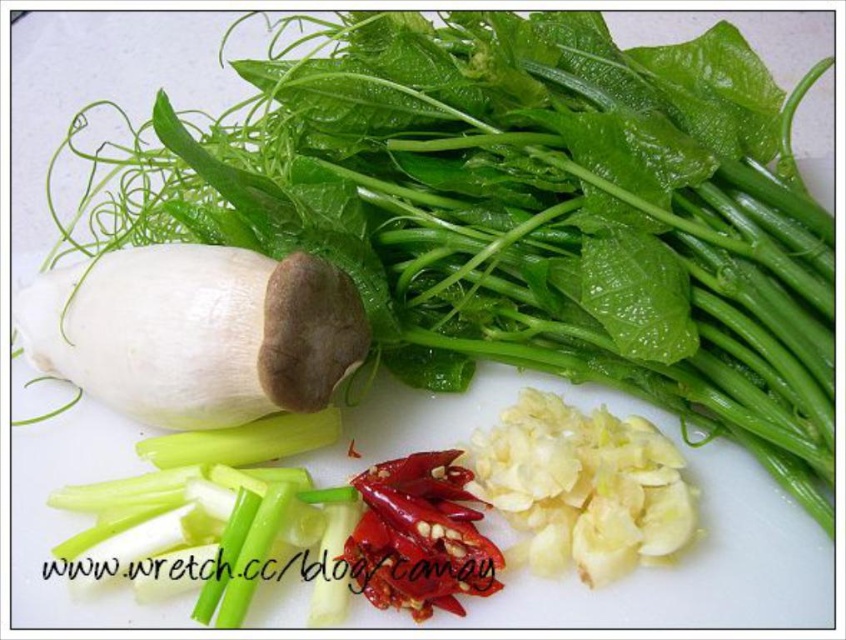
Between point (259, 400) and point (400, 604), which one is positioned behind?

The point (259, 400) is more distant.

Is the position of white matte garlic at center more distant than that of red matte pepper at center?

No, white matte garlic at center is closer to the viewer.

Does point (157, 340) come behind point (470, 582)?

Yes, point (157, 340) is farther from viewer.

Where is `white matte garlic at center`? white matte garlic at center is located at coordinates (196, 332).